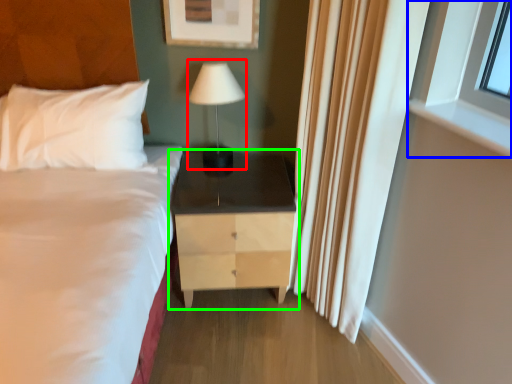
Question: Estimate the real-world distances between objects in this image. Which object is closer to table lamp (highlighted by a red box), window (highlighted by a blue box) or nightstand (highlighted by a green box)?

Choices:
 (A) window
 (B) nightstand

Answer: (B)